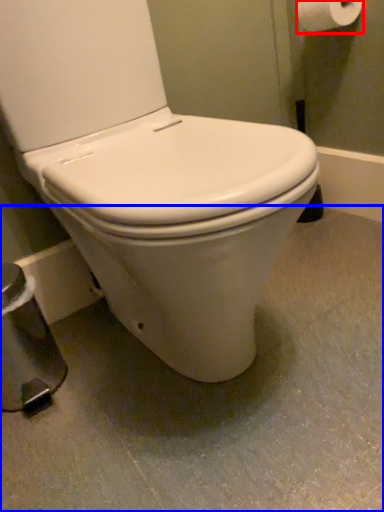
Question: Which object appears closest to the camera in this image, toilet paper (highlighted by a red box) or concrete (highlighted by a blue box)?

Choices:
 (A) toilet paper
 (B) concrete

Answer: (B)